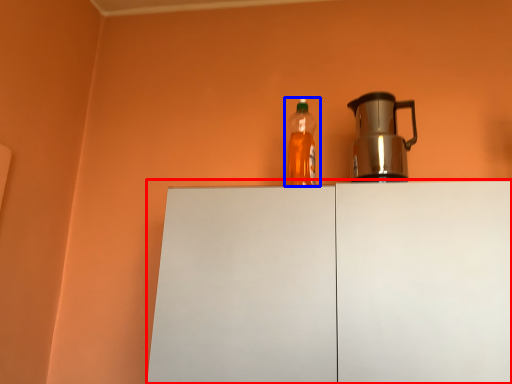
Question: Which object is further to the camera taking this photo, cabinetry (highlighted by a red box) or bottle (highlighted by a blue box)?

Choices:
 (A) cabinetry
 (B) bottle

Answer: (B)